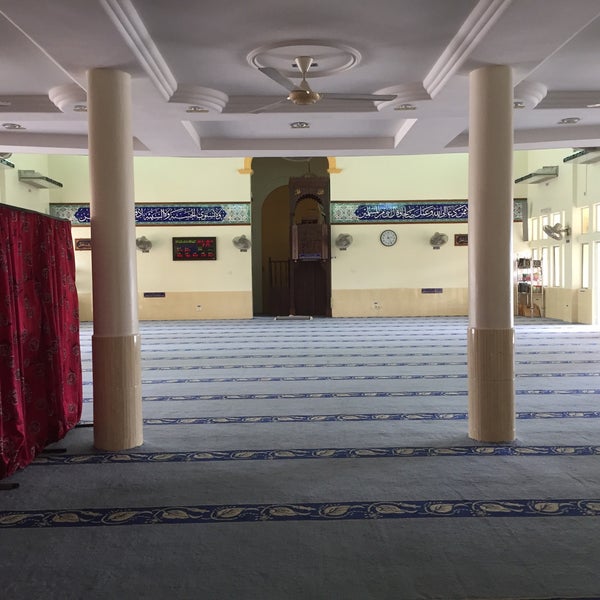
The width and height of the screenshot is (600, 600). Identify the location of light. (532, 195).